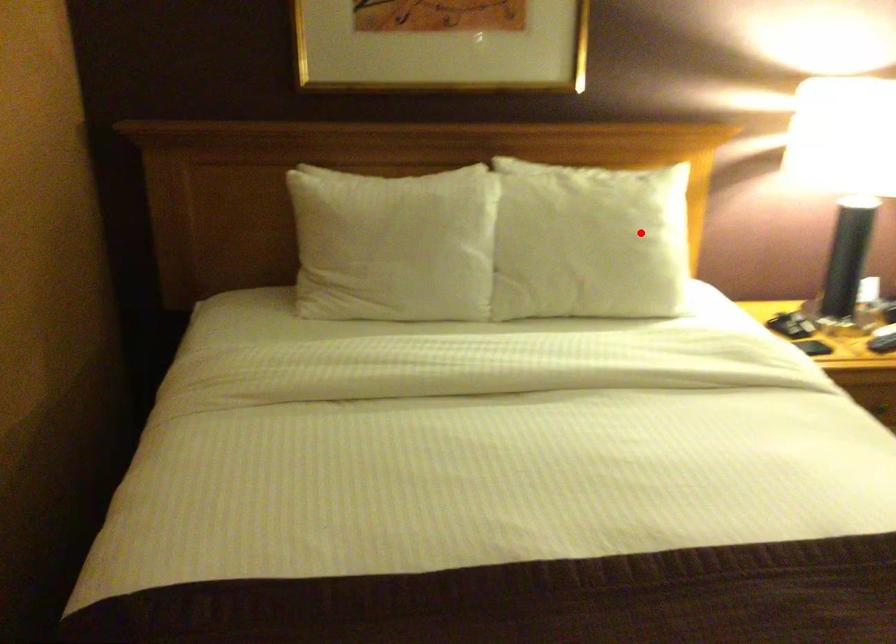
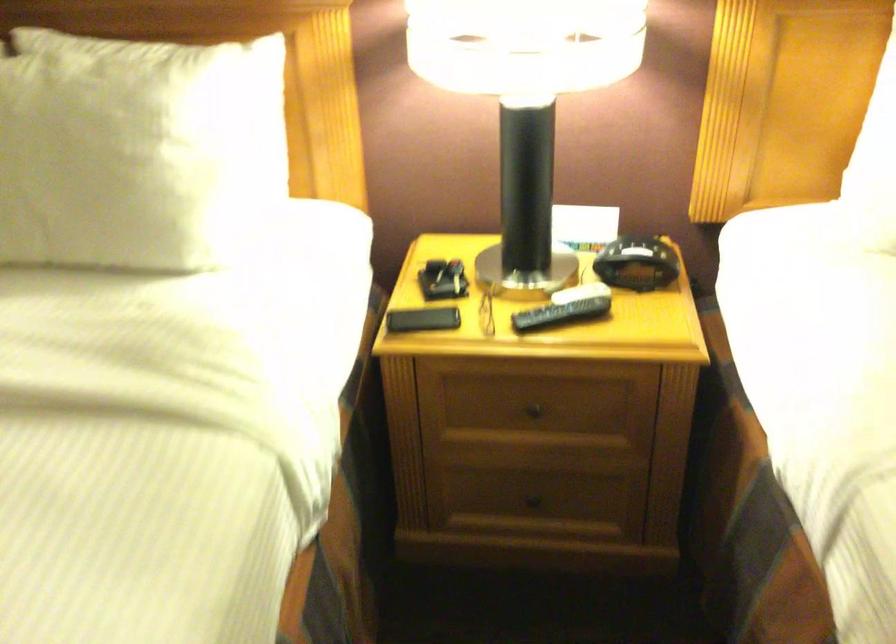
Locate, in the second image, the point that corresponds to the highlighted location in the first image.

(134, 149)